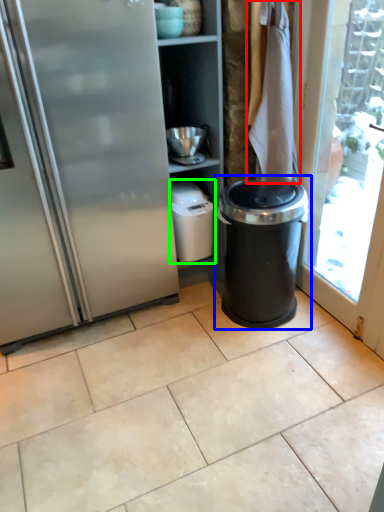
Question: Estimate the real-world distances between objects in this image. Which object is closer to laundry (highlighted by a red box), waste container (highlighted by a blue box) or appliance (highlighted by a green box)?

Choices:
 (A) waste container
 (B) appliance

Answer: (A)